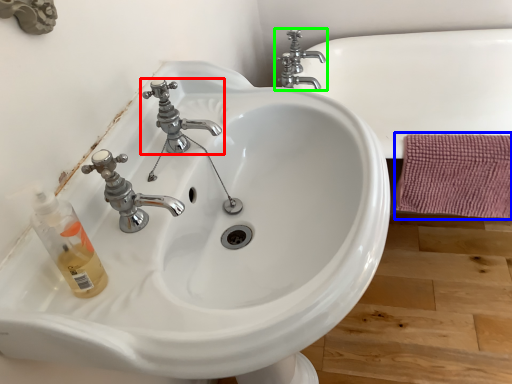
Question: Considering the real-world distances, which object is closest to tap (highlighted by a red box)? bath towel (highlighted by a blue box) or tap (highlighted by a green box).

Choices:
 (A) bath towel
 (B) tap

Answer: (A)